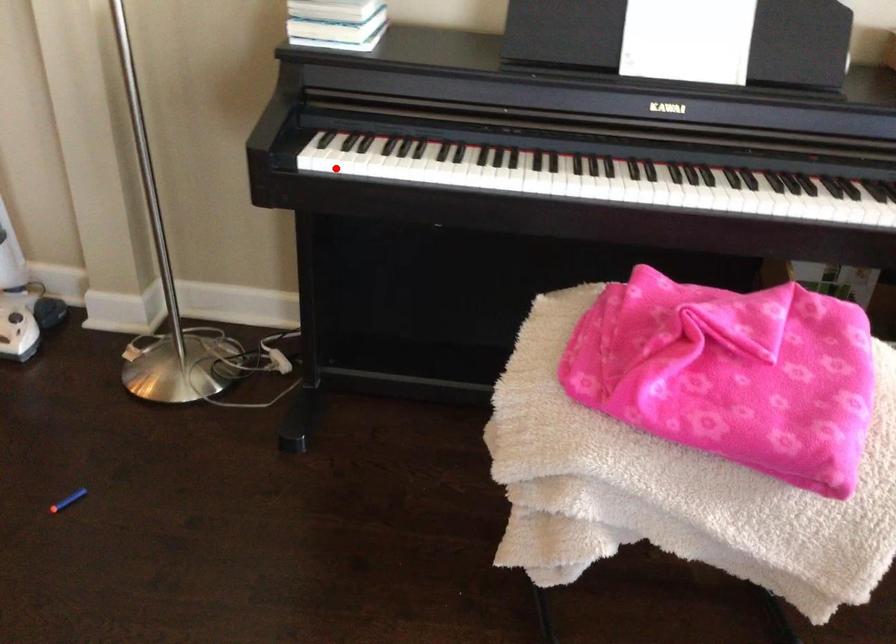
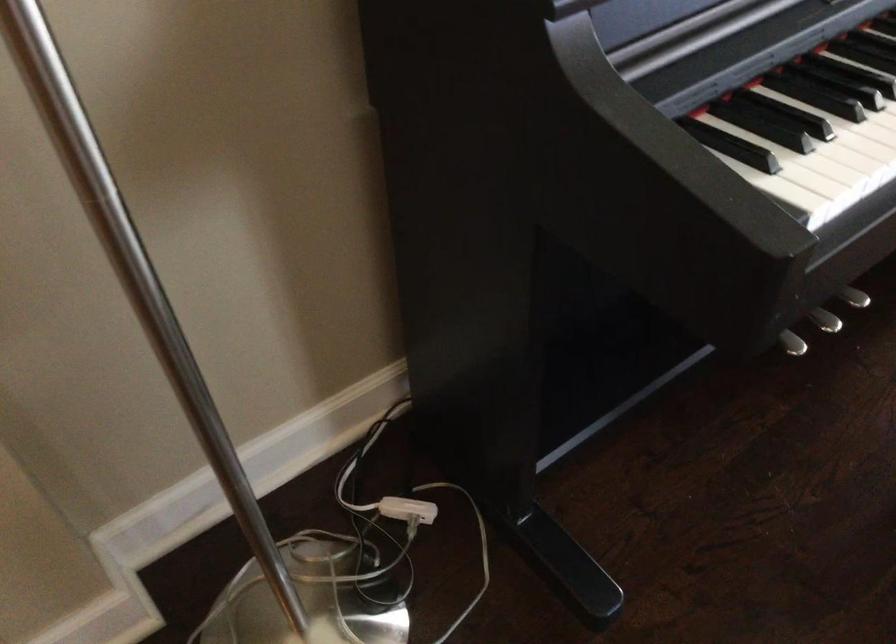
Question: A red point is marked in image1. In image2, is the corresponding 3D point closer to the camera or farther? Reply with the corresponding letter.

Choices:
 (A) The corresponding 3D point is closer.
 (B) The corresponding 3D point is farther.

Answer: (A)